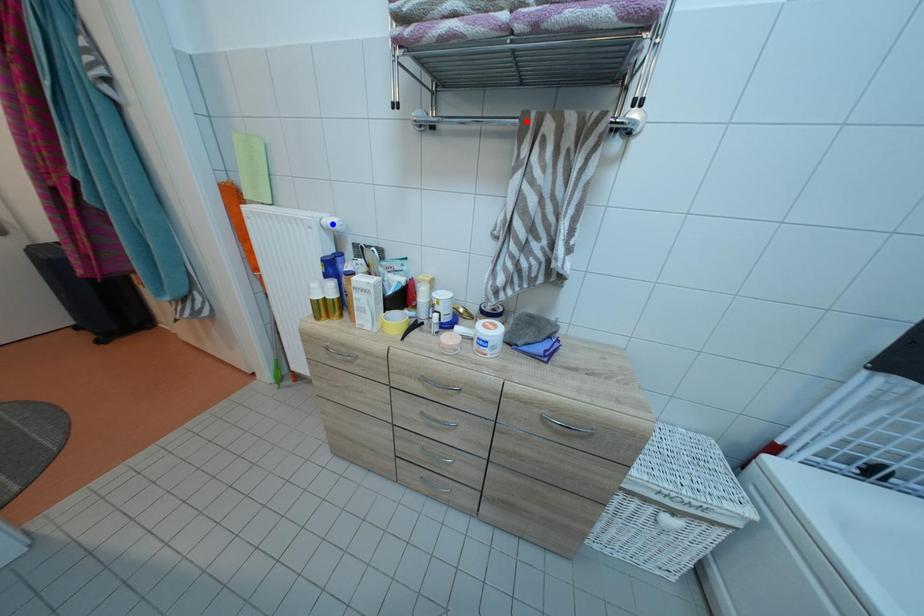
Question: In the image, two points are highlighted. Which point is nearer to the camera? Reply with the corresponding letter.

Choices:
 (A) blue point
 (B) red point

Answer: (B)